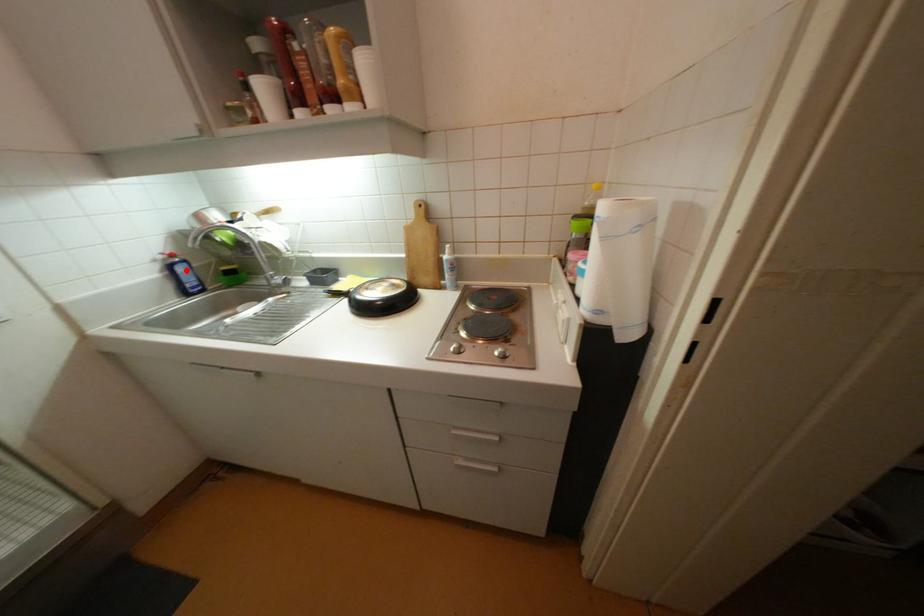
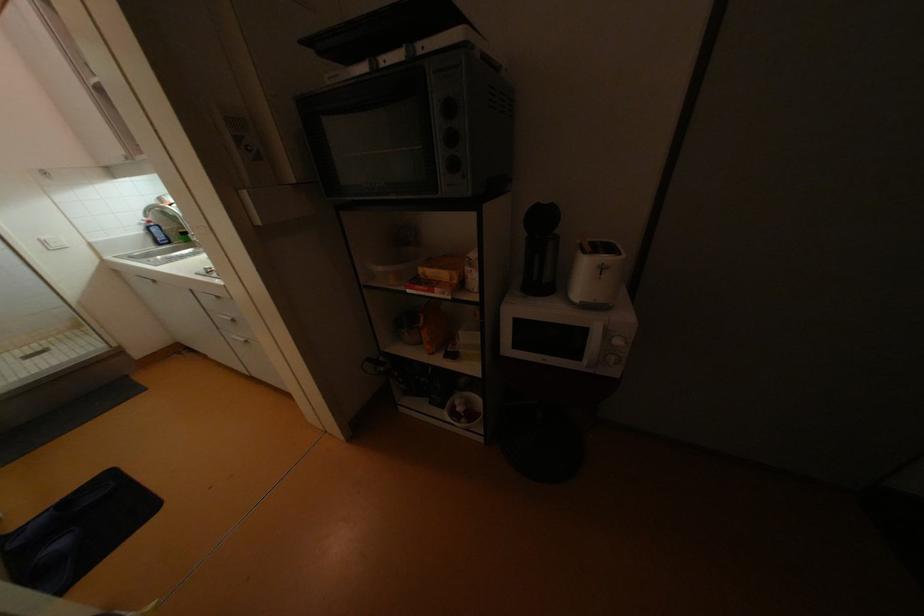
Where in the second image is the point corresponding to the highlighted location from the first image?

(160, 231)